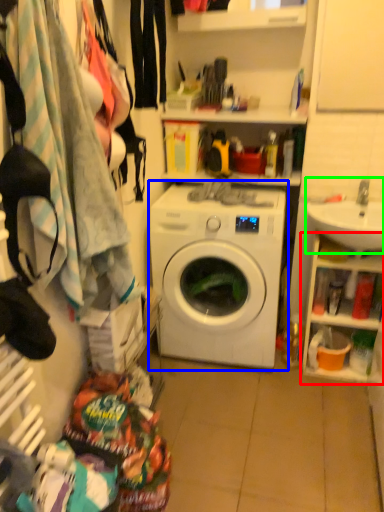
Question: Based on their relative distances, which object is farther from cabinet (highlighted by a red box)? Choose from washing machine (highlighted by a blue box) and sink (highlighted by a green box).

Choices:
 (A) washing machine
 (B) sink

Answer: (A)